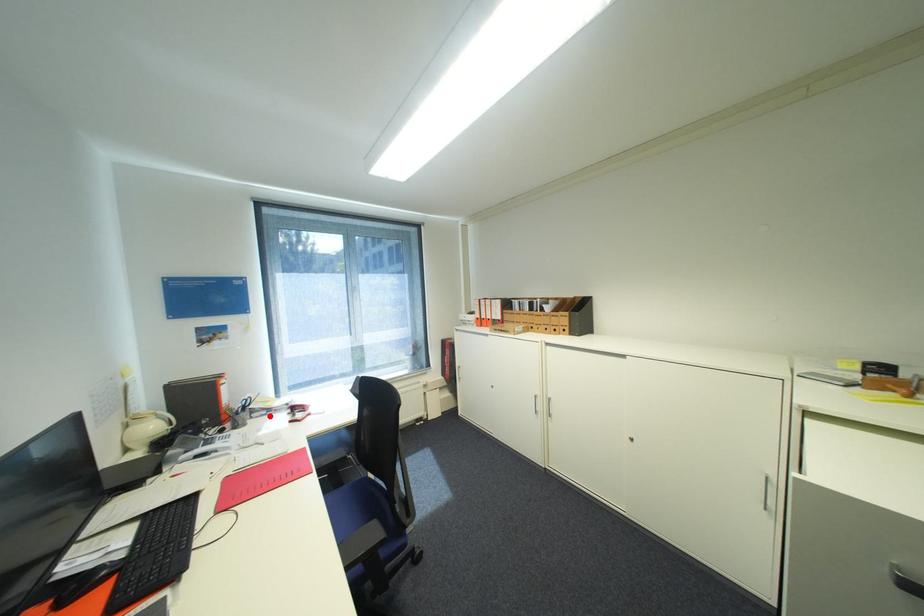
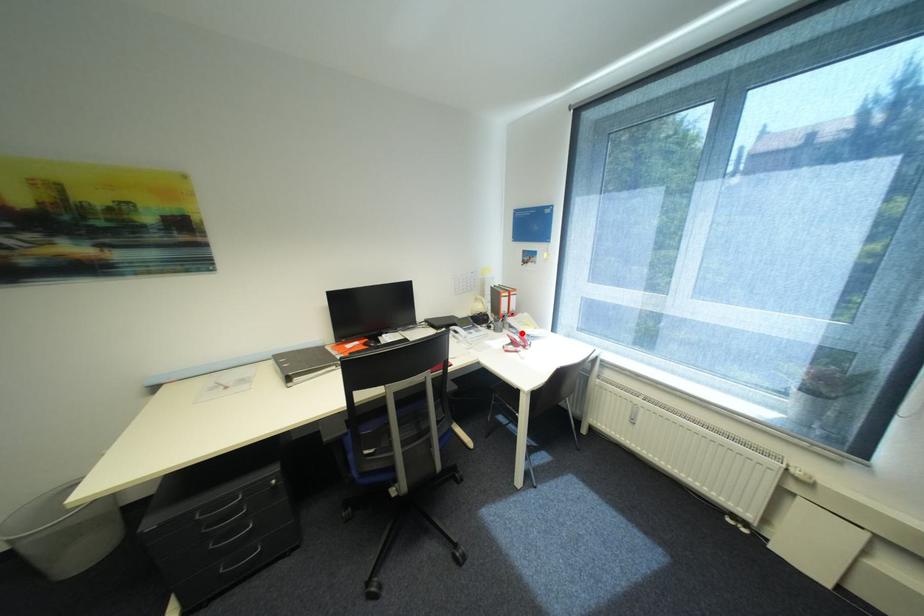
I am providing you with two images of the same scene from different viewpoints. A red point is marked on the first image and another point is marked on the second image. Is the marked point in image1 the same physical position as the marked point in image2?

Yes